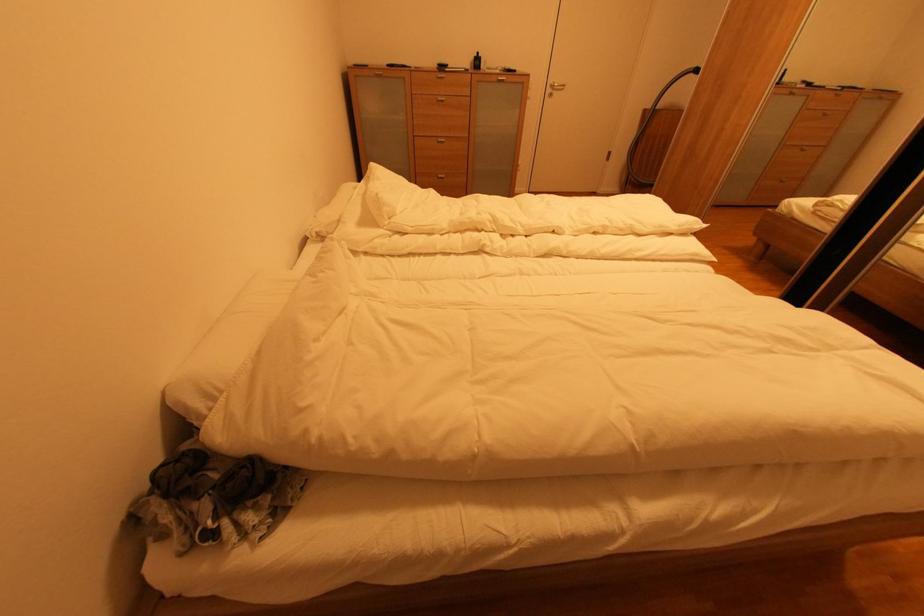
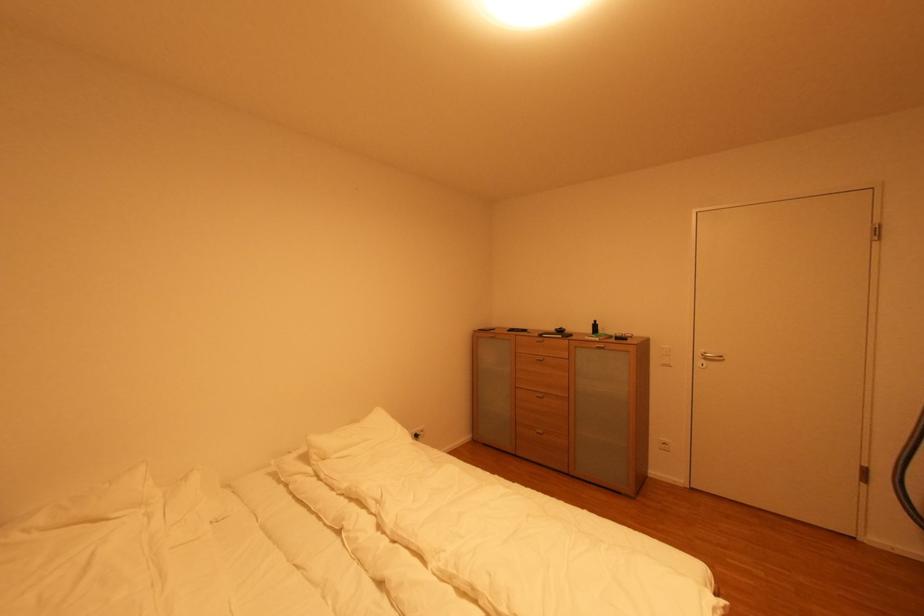
Find the pixel in the second image that matches point (554, 92) in the first image.

(706, 362)